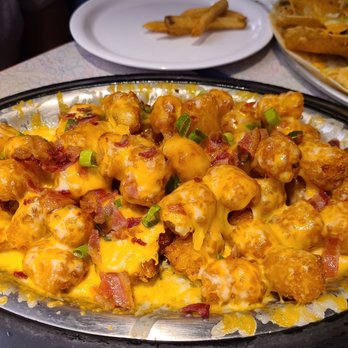
I want to click on metal bowl, so click(x=185, y=331).